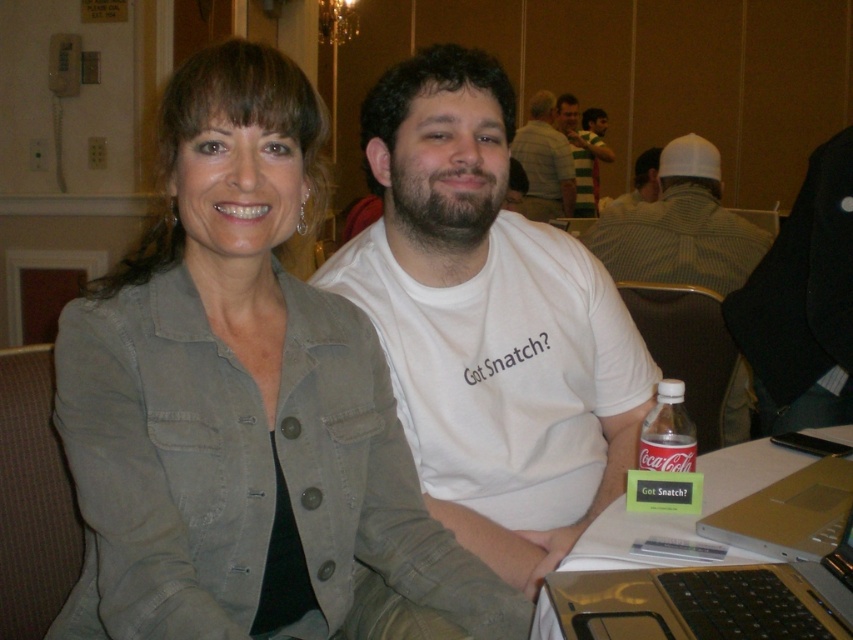
You are standing in the conference room and see the point at coordinates (680, 227). What object is located at that point?

The point at coordinates (680, 227) corresponds to the white checkered shirt at center.

Based on the scene description, where is the denim jacket at center positioned relative to the two individuals?

The denim jacket at center is located at point coordinates of 0.628 on the x axis and 0.284 on the y axis.